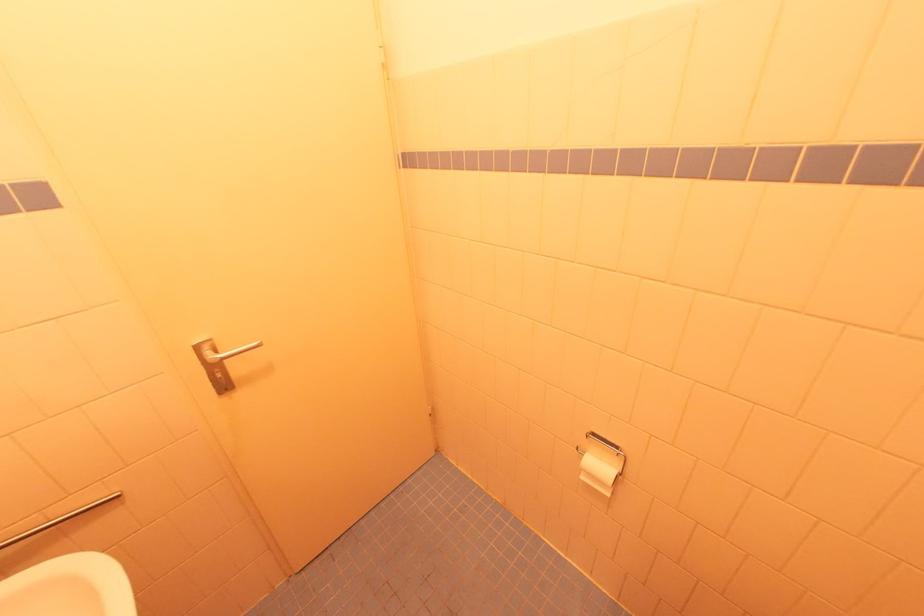
The width and height of the screenshot is (924, 616). What do you see at coordinates (213, 367) in the screenshot? I see `the metal door handle` at bounding box center [213, 367].